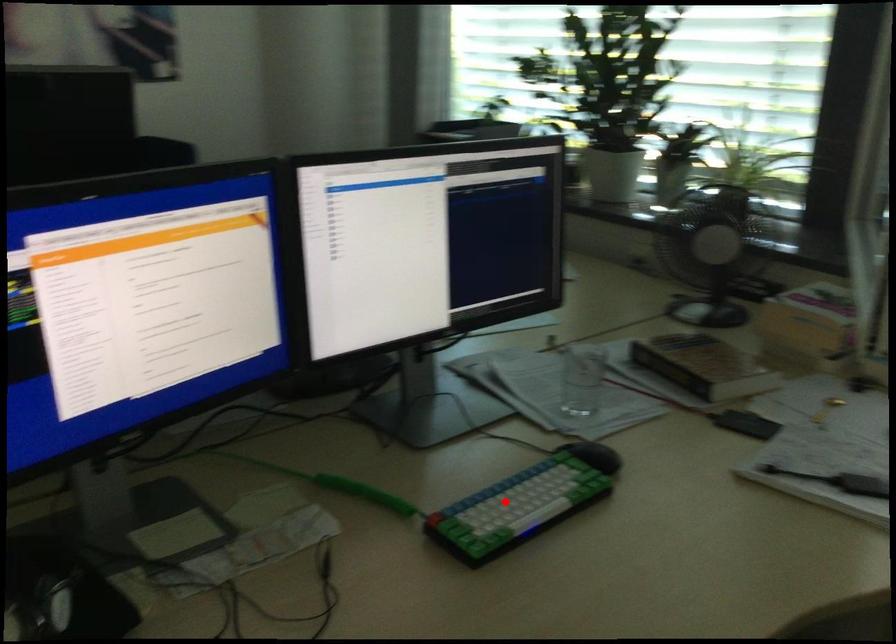
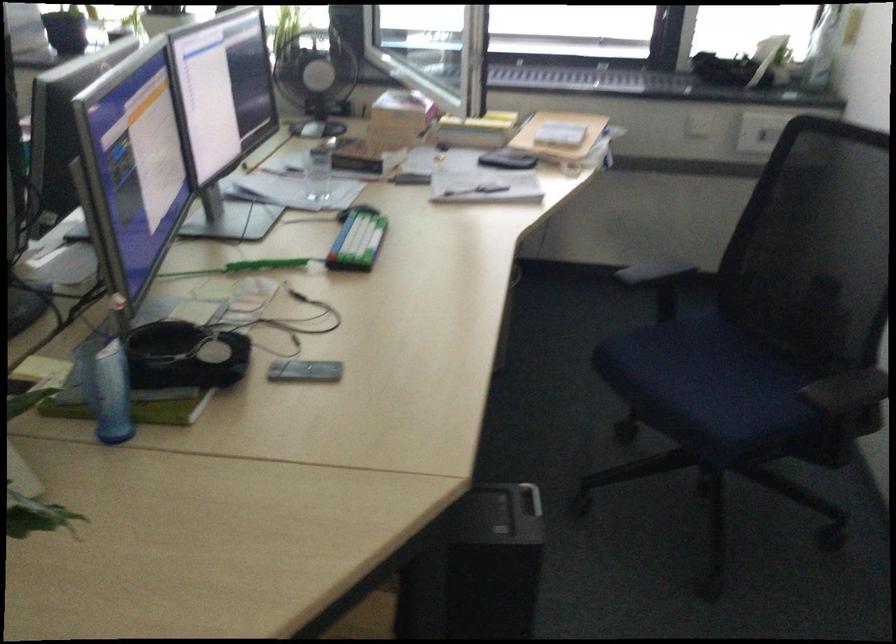
Question: I am providing you with two images of the same scene from different viewpoints. In image1, a red point is highlighted. Considering the same 3D point in image2, which of the following is correct?

Choices:
 (A) It is closer
 (B) It is farther

Answer: (B)